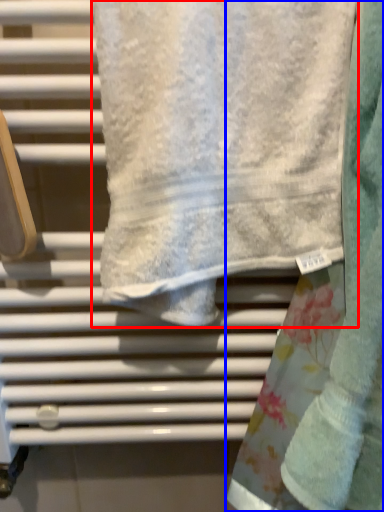
Question: Which object is further to the camera taking this photo, towel (highlighted by a red box) or towel (highlighted by a blue box)?

Choices:
 (A) towel
 (B) towel

Answer: (A)